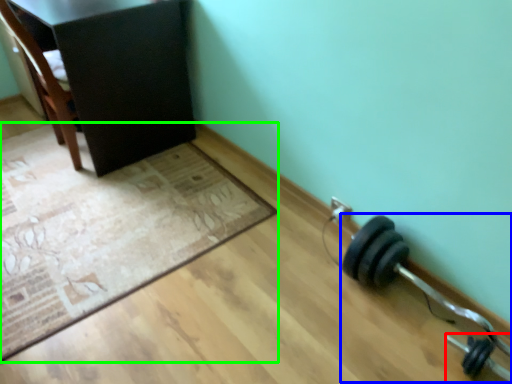
Question: Which is nearer to the dumbbell (highlighted by a red box)? dumbbell (highlighted by a blue box) or mat (highlighted by a green box).

Choices:
 (A) dumbbell
 (B) mat

Answer: (A)